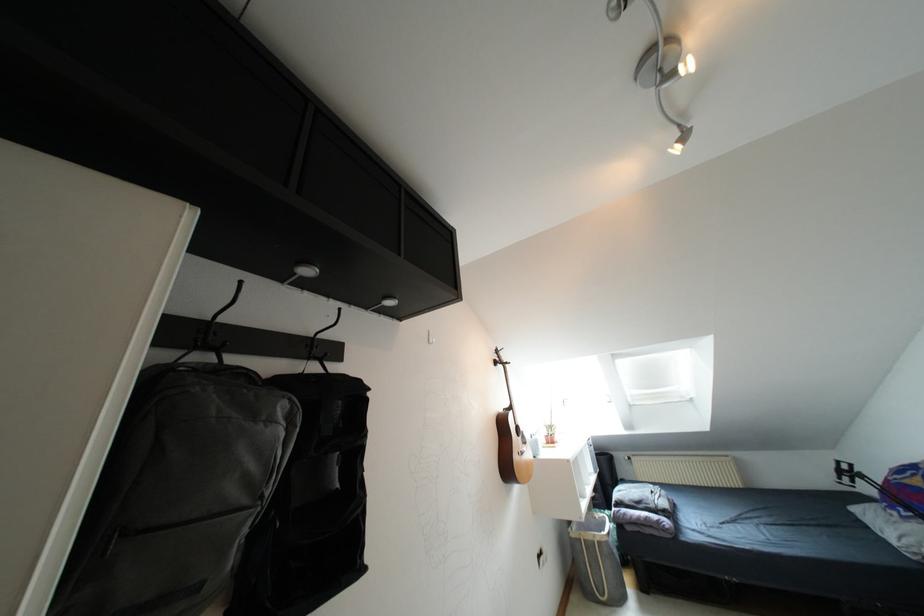
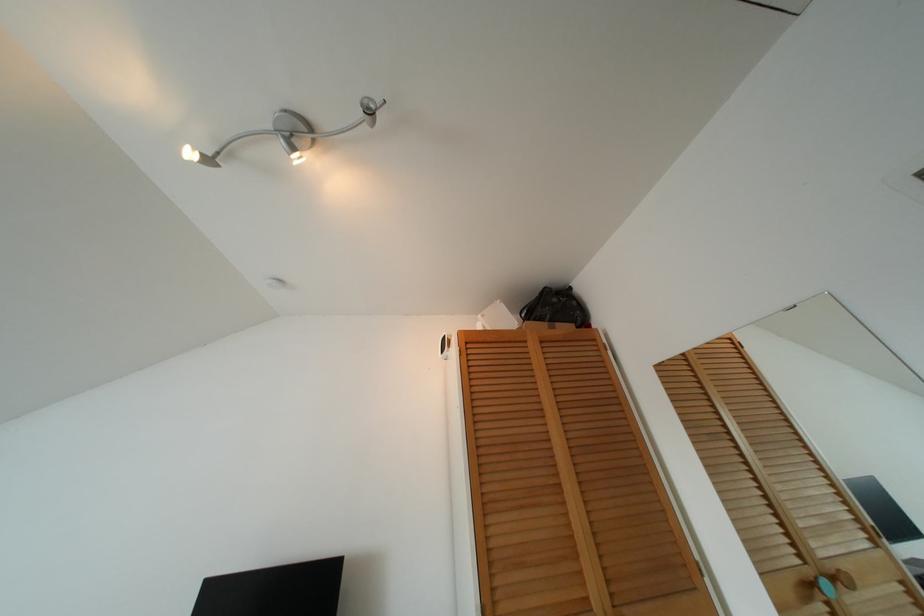
In the second image, find the point that corresponds to point (687, 69) in the first image.

(297, 158)